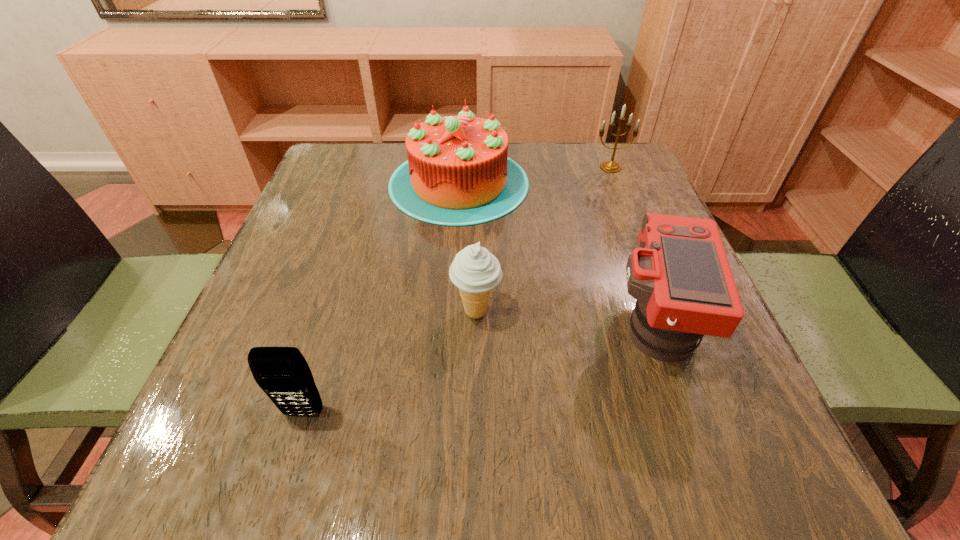
In the image, there is a desktop. Where is `blank space at the near left corner`? This screenshot has height=540, width=960. blank space at the near left corner is located at coordinates (292, 444).

Where is `free space at the far right corner of the desktop`? free space at the far right corner of the desktop is located at coordinates [x=587, y=166].

Locate an element on the screen. The width and height of the screenshot is (960, 540). free space between the camera and the cake is located at coordinates (557, 253).

I want to click on free space between the candelabrum and the camera, so click(633, 245).

The width and height of the screenshot is (960, 540). In order to click on free point between the camera and the icecream in this screenshot , I will do `click(565, 318)`.

Find the location of `empty space between the camera and the icecream`. empty space between the camera and the icecream is located at coordinates (565, 318).

Identify the location of blank region between the leftmost object and the cake. (381, 298).

Identify the location of empty space that is in between the candelabrum and the camera. (633, 245).

Find the location of a particular element. Image resolution: width=960 pixels, height=540 pixels. free point between the cake and the camera is located at coordinates (557, 253).

Identify the location of vacant point located between the candelabrum and the camera. (633, 245).